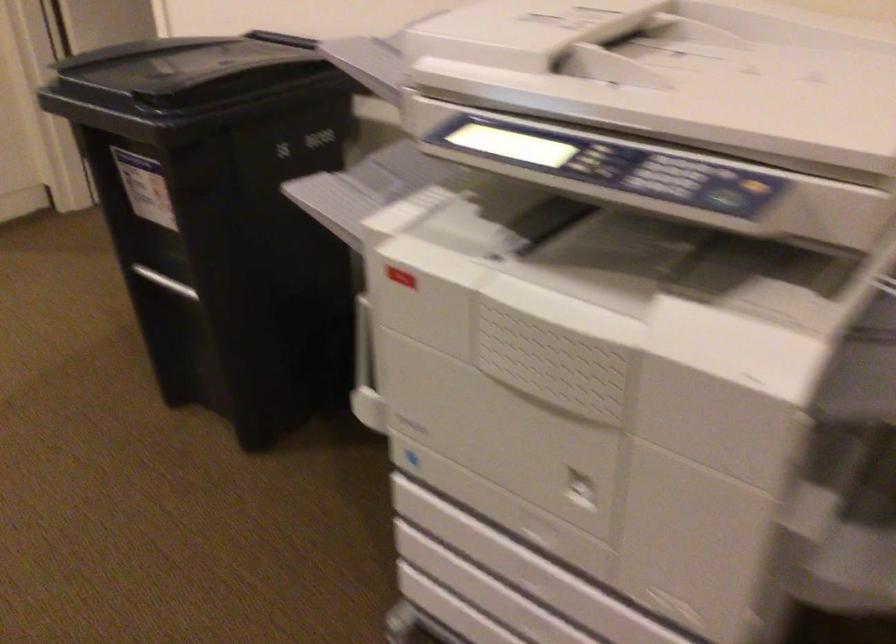
Describe the element at coordinates (725, 200) in the screenshot. The height and width of the screenshot is (644, 896). I see `the printer start button` at that location.